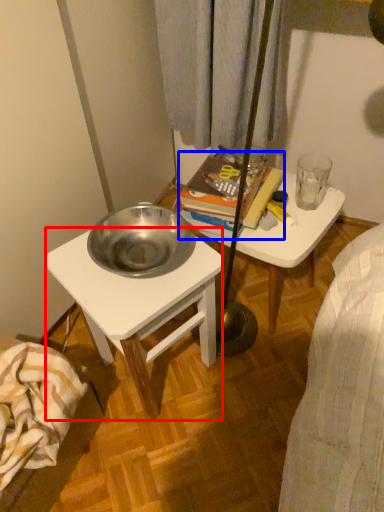
Question: Which object is further to the camera taking this photo, desk (highlighted by a red box) or book (highlighted by a blue box)?

Choices:
 (A) desk
 (B) book

Answer: (B)